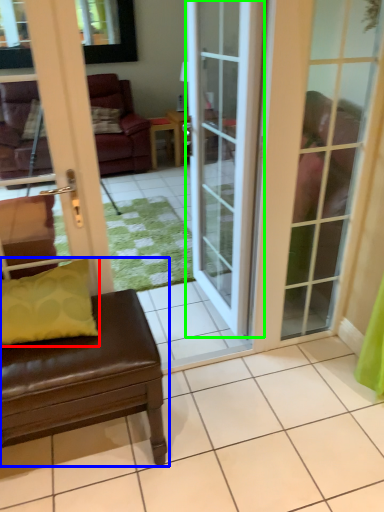
Question: Which object is positioned farthest from pillow (highlighted by a red box)? Select from studio couch (highlighted by a blue box) and door (highlighted by a green box).

Choices:
 (A) studio couch
 (B) door

Answer: (B)